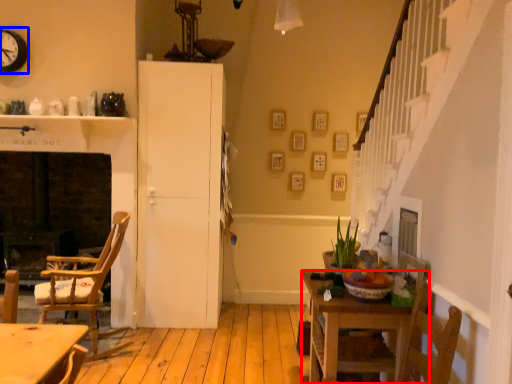
Question: Which object is further to the camera taking this photo, kitchen & dining room table (highlighted by a red box) or clock (highlighted by a blue box)?

Choices:
 (A) kitchen & dining room table
 (B) clock

Answer: (B)